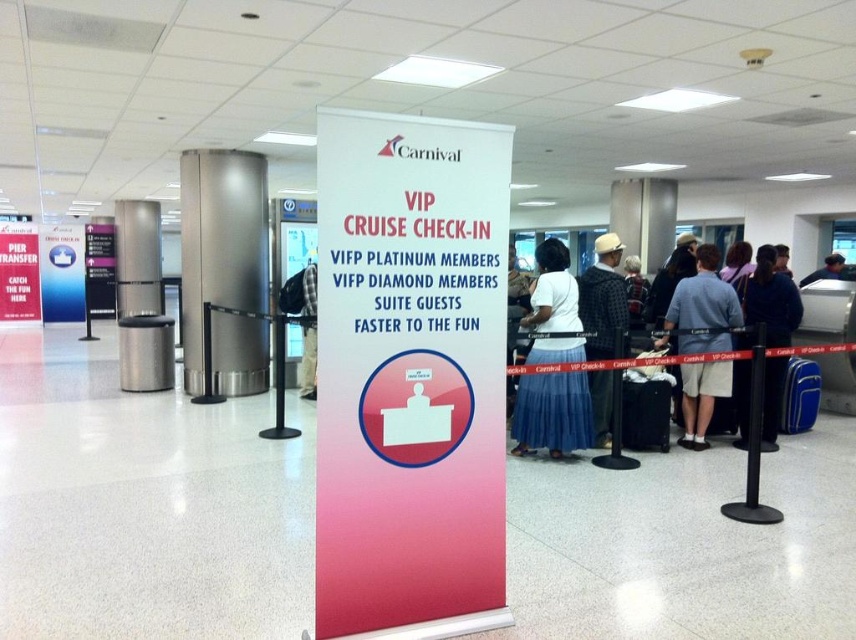
You are at the airport and need to locate the VIP Cruise Check In area. You see two signs, a pink paper sign at center and a white paper sign at center. Which sign is closer to you?

The pink paper sign at center is closer to you because it is in front of the white paper sign at center.

In the scene shown: You are at the cruise check in area and see a person wearing a gray cotton shirt at center. Where exactly is this person positioned in the scene?

The gray cotton shirt at center is located at point 0.483 on the x axis and 0.821 on the y axis.

You are a passenger at the airport and see two people in front of you. One is wearing a gray cotton shirt at center and the other is wearing a plaid fabric shirt at center. Which person is taller?

The gray cotton shirt at center has a greater height compared to plaid fabric shirt at center, so the person wearing the gray cotton shirt at center is taller.